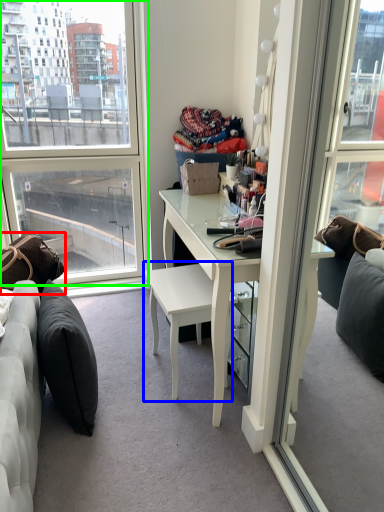
Question: Estimate the real-world distances between objects in this image. Which object is closer to pillow (highlighted by a red box), chair (highlighted by a blue box) or window (highlighted by a green box)?

Choices:
 (A) chair
 (B) window

Answer: (A)